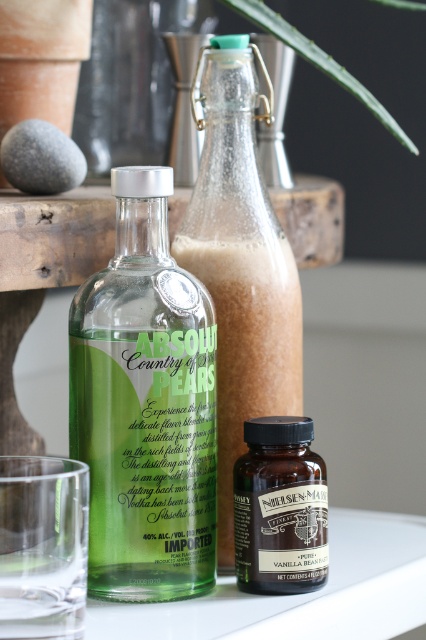
Who is positioned more to the right, brown glass bottle at center or green leafy plant at upper center?

Positioned to the right is green leafy plant at upper center.

Is brown glass bottle at center taller than green leafy plant at upper center?

No.

Is point (310, 477) closer to camera compared to point (265, 6)?

Yes, it is in front of point (265, 6).

The height and width of the screenshot is (640, 426). What are the coordinates of `brown glass bottle at center` in the screenshot? It's located at (279, 508).

Between clear glass at center and brown glass bottle at center, which one appears on the right side from the viewer's perspective?

clear glass at center

Between clear glass at center and brown glass bottle at center, which one is positioned higher?

brown glass bottle at center is higher up.

Does point (386, 596) lie behind point (255, 449)?

That is True.

This screenshot has height=640, width=426. Find the location of `clear glass at center`. clear glass at center is located at coordinates [x=299, y=593].

Which of these two, green glass bottle at center or clear glass bottle at center, stands taller?

clear glass bottle at center

Describe the element at coordinates (144, 406) in the screenshot. The width and height of the screenshot is (426, 640). I see `green glass bottle at center` at that location.

Find the location of a particular element. This screenshot has height=640, width=426. green glass bottle at center is located at coordinates (144, 406).